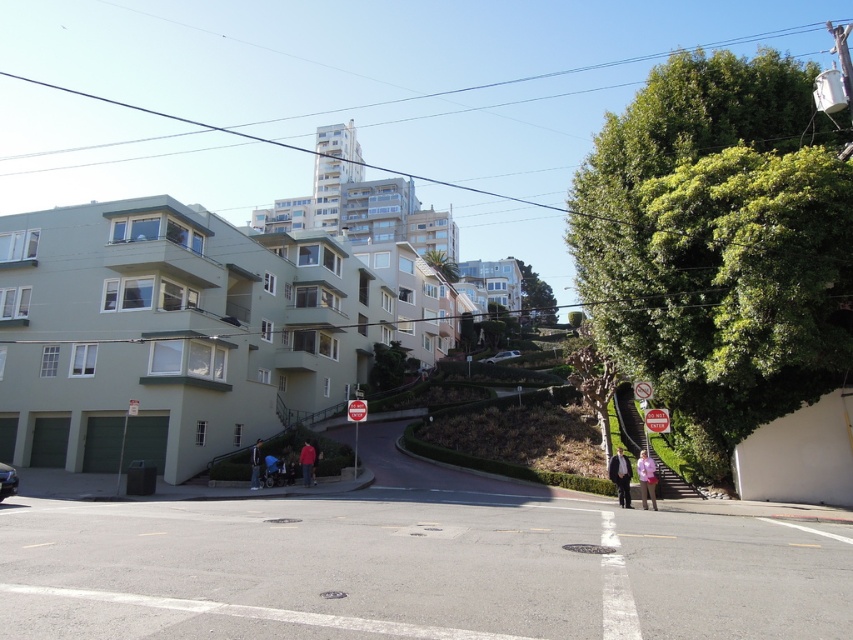
Who is taller, blue denim jacket at lower center or white matte car at center?

With more height is white matte car at center.

Can you confirm if blue denim jacket at lower center is smaller than white matte car at center?

Yes, blue denim jacket at lower center is smaller than white matte car at center.

Locate an element on the screen. The width and height of the screenshot is (853, 640). blue denim jacket at lower center is located at coordinates (254, 465).

Looking at this image, does dark gray suit at lower right appear on the left side of white matte car at center?

Yes, dark gray suit at lower right is to the left of white matte car at center.

Identify the location of dark gray suit at lower right. (619, 476).

Who is more forward, (624,497) or (491,358)?

Point (624,497) is more forward.

Locate an element on the screen. dark gray suit at lower right is located at coordinates coord(619,476).

Does metallic rectangular sign at center appear on the right side of red cotton shirt at center?

Indeed, metallic rectangular sign at center is positioned on the right side of red cotton shirt at center.

Is point (663, 426) positioned after point (305, 440)?

That is False.

Is point (669, 428) positioned before point (312, 468)?

Yes, it is.

Locate an element on the screen. This screenshot has width=853, height=640. metallic rectangular sign at center is located at coordinates 656,420.